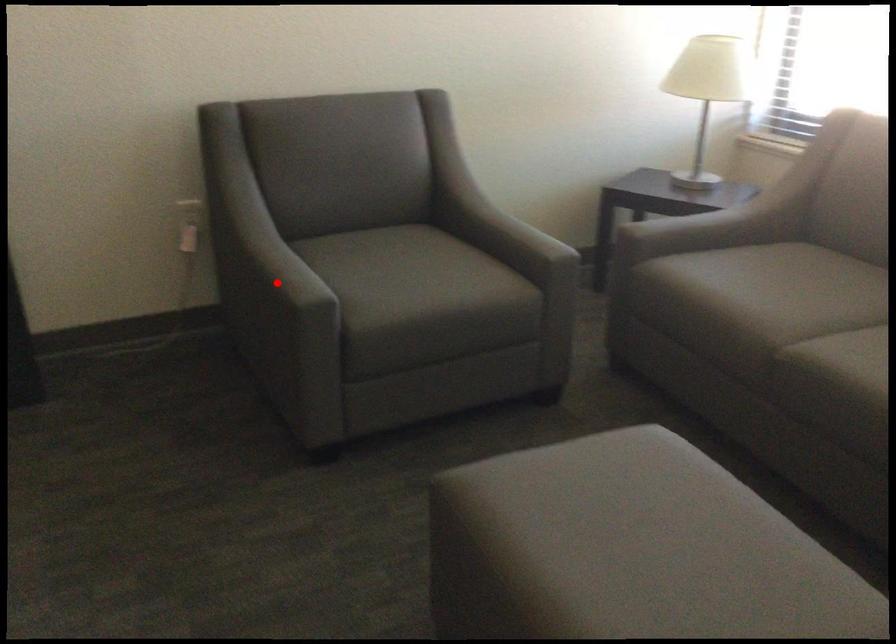
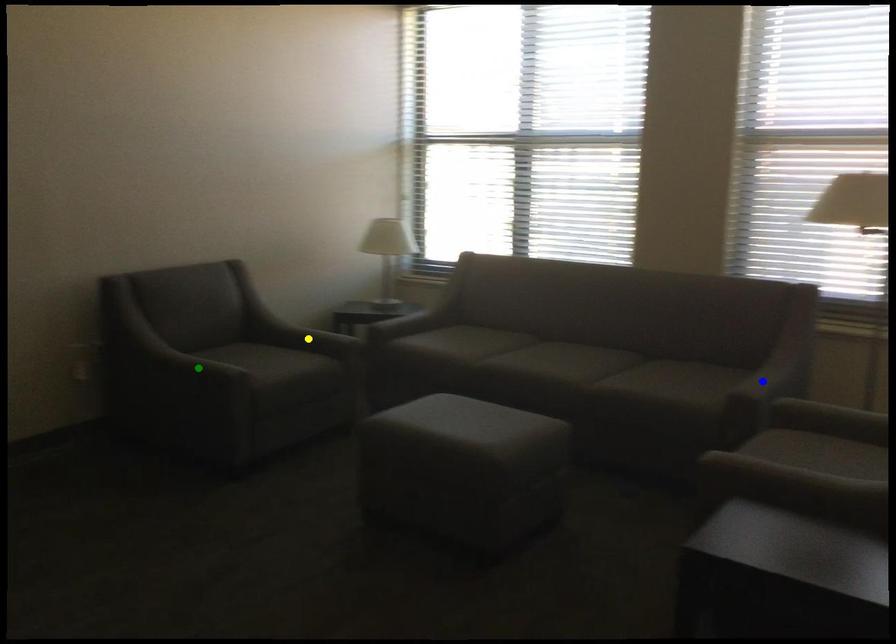
Question: I am providing you with two images of the same scene from different viewpoints. A red point is marked on the first image. You are given multiple points on the second image. Which mark in image 2 goes with the point in image 1?

Choices:
 (A) green point
 (B) yellow point
 (C) blue point

Answer: (A)